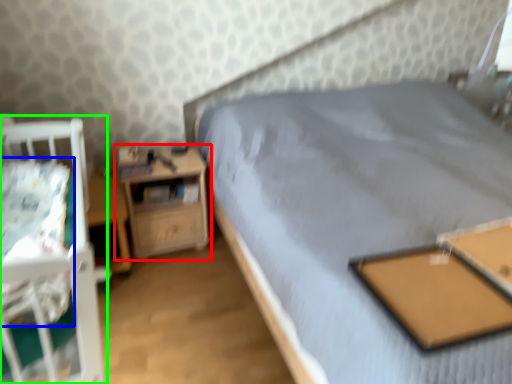
Question: Based on their relative distances, which object is farther from nightstand (highlighted by a red box)? Choose from sheet (highlighted by a blue box) and infant bed (highlighted by a green box).

Choices:
 (A) sheet
 (B) infant bed

Answer: (A)